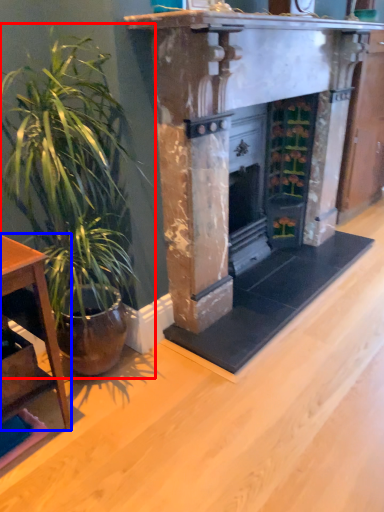
Question: Which object appears farthest to the camera in this image, houseplant (highlighted by a red box) or table (highlighted by a blue box)?

Choices:
 (A) houseplant
 (B) table

Answer: (B)